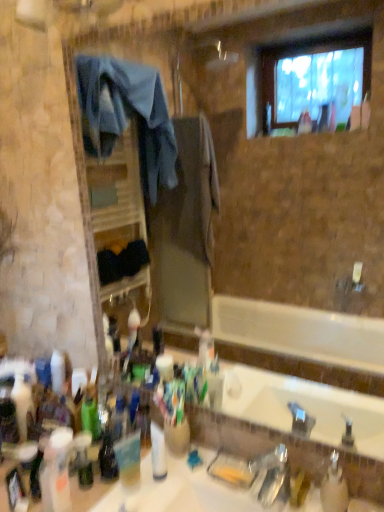
Where is `free space that is in between metallic silver faucet at lower center and translucent plastic cup at lower center`? The width and height of the screenshot is (384, 512). free space that is in between metallic silver faucet at lower center and translucent plastic cup at lower center is located at coordinates (189, 495).